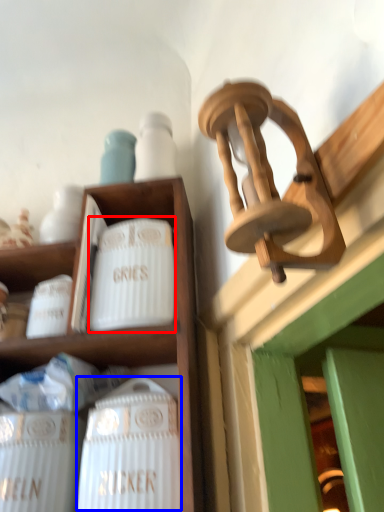
Question: Which object appears farthest to the camera in this image, pottery (highlighted by a red box) or wine bottle (highlighted by a blue box)?

Choices:
 (A) pottery
 (B) wine bottle

Answer: (A)